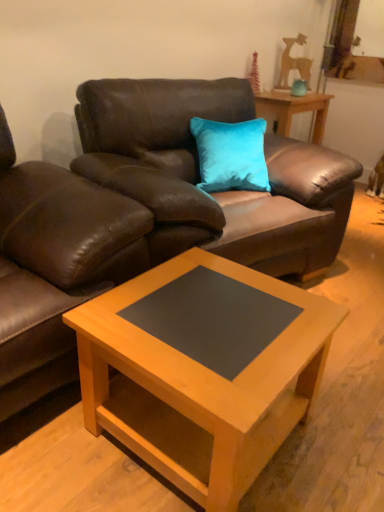
The image size is (384, 512). I want to click on free location to the right of light wood/black laminate coffee table at center, so click(x=341, y=424).